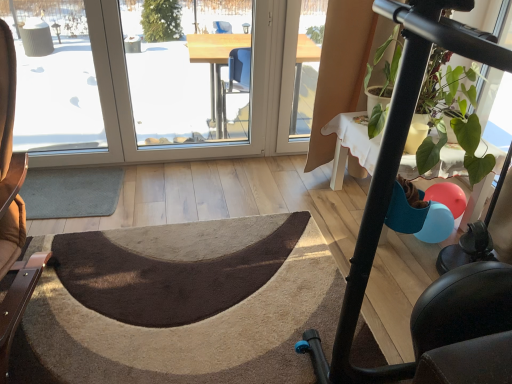
At what (x,y) coordinates should I click in order to perform the action: click on vacant space underneath brown textured rug at center, which appears as the first doormat when ordered from the bottom (from a real-world perspective). Please return your answer as a coordinate pair (x, y). This screenshot has width=512, height=384. Looking at the image, I should click on (193, 262).